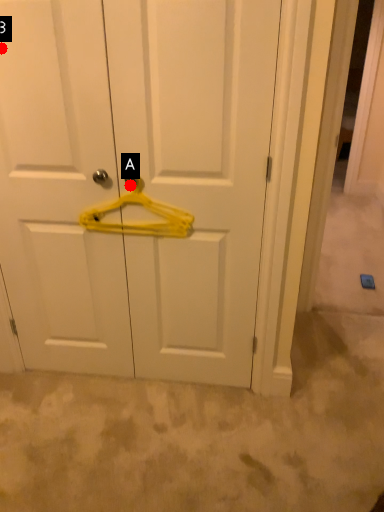
Question: Two points are circled on the image, labeled by A and B beside each circle. Which point is closer to the camera?

Choices:
 (A) A is closer
 (B) B is closer

Answer: (B)